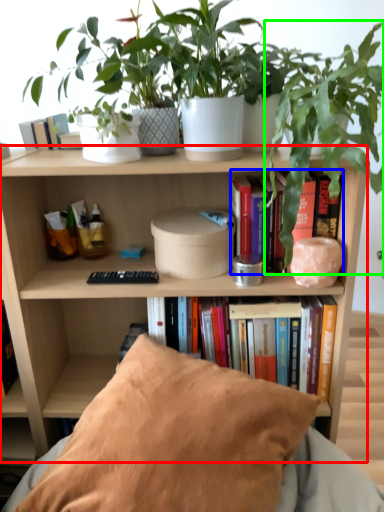
Question: Which object is the closest to the bookcase (highlighted by a red box)? Choose among these: book (highlighted by a blue box) or houseplant (highlighted by a green box).

Choices:
 (A) book
 (B) houseplant

Answer: (B)